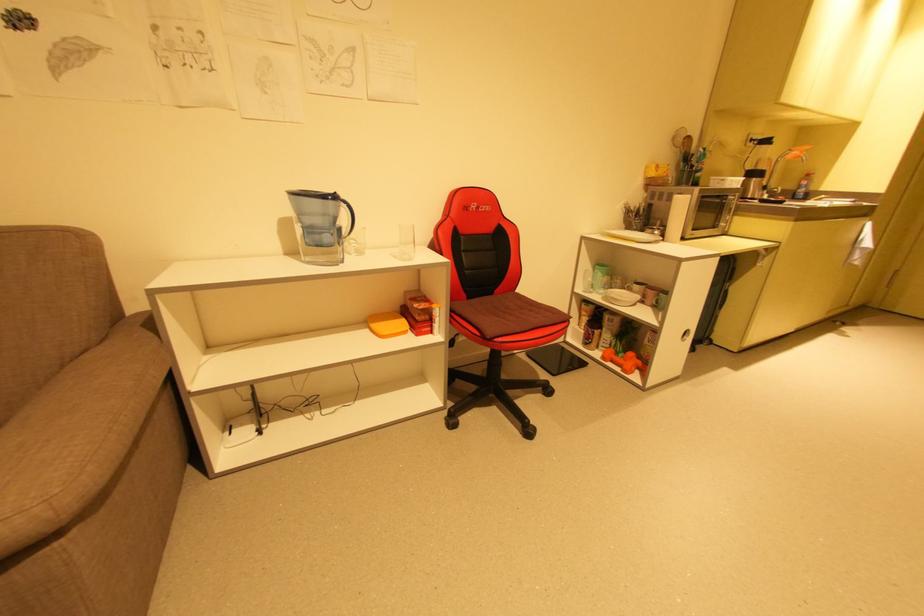
Image resolution: width=924 pixels, height=616 pixels. What do you see at coordinates (785, 161) in the screenshot?
I see `the faucet handle` at bounding box center [785, 161].